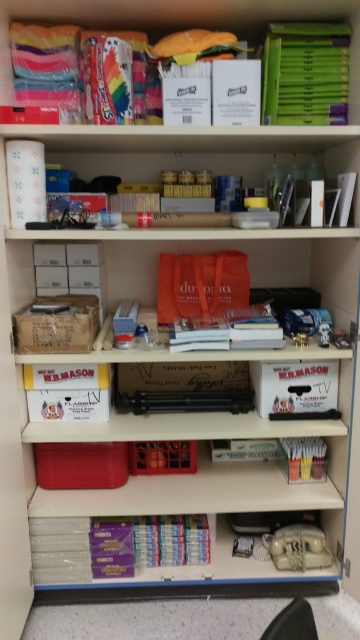
Can you confirm if white paper towel at upper center is positioned below green matte folder at upper right?

Yes, white paper towel at upper center is below green matte folder at upper right.

Does point (92, 236) come farther from viewer compared to point (315, 29)?

No, it is in front of (315, 29).

Locate an element on the screen. white paper towel at upper center is located at coordinates (178, 152).

Is point (65, 132) positioned in front of point (69, 532)?

Yes, point (65, 132) is in front of point (69, 532).

What are the coordinates of `white paper towel at upper center` in the screenshot? It's located at (178, 152).

Which of these two, white paper towel at upper center or matte plastic book at upper center, stands shorter?

matte plastic book at upper center is shorter.

Is white paper towel at upper center above matte plastic book at upper center?

Actually, white paper towel at upper center is below matte plastic book at upper center.

Identify the location of white paper towel at upper center. (178, 152).